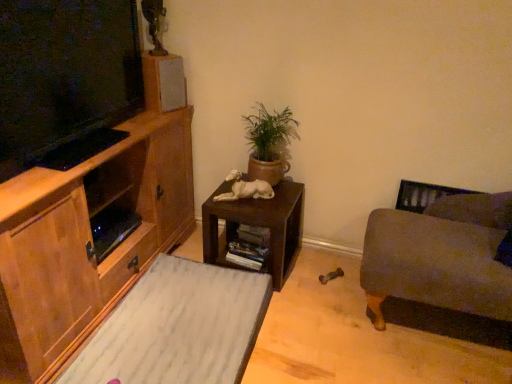
Question: Is velvet gray couch at right positioned before green terracotta pot at center?

Choices:
 (A) no
 (B) yes

Answer: (B)

Question: Does velvet gray couch at right have a greater height compared to green terracotta pot at center?

Choices:
 (A) yes
 (B) no

Answer: (A)

Question: From the image's perspective, does velvet gray couch at right appear lower than green terracotta pot at center?

Choices:
 (A) yes
 (B) no

Answer: (A)

Question: Does velvet gray couch at right come behind green terracotta pot at center?

Choices:
 (A) no
 (B) yes

Answer: (A)

Question: Is velvet gray couch at right completely or partially outside of green terracotta pot at center?

Choices:
 (A) yes
 (B) no

Answer: (A)

Question: Is point (205, 238) positioned closer to the camera than point (239, 279)?

Choices:
 (A) farther
 (B) closer

Answer: (A)

Question: Is dark brown wooden table at center inside or outside of white marble rug at lower left?

Choices:
 (A) outside
 (B) inside

Answer: (A)

Question: From the image's perspective, relative to white marble rug at lower left, is dark brown wooden table at center above or below?

Choices:
 (A) above
 (B) below

Answer: (A)

Question: From a real-world perspective, relative to white marble rug at lower left, is dark brown wooden table at center vertically above or below?

Choices:
 (A) below
 (B) above

Answer: (B)

Question: Considering the positions of matte gray speaker at upper center and wooden cabinet at left in the image, is matte gray speaker at upper center taller or shorter than wooden cabinet at left?

Choices:
 (A) short
 (B) tall

Answer: (A)

Question: From a real-world perspective, relative to wooden cabinet at left, is matte gray speaker at upper center vertically above or below?

Choices:
 (A) above
 (B) below

Answer: (A)

Question: Looking at their shapes, would you say matte gray speaker at upper center is wider or thinner than wooden cabinet at left?

Choices:
 (A) wide
 (B) thin

Answer: (B)

Question: Considering their positions, is matte gray speaker at upper center located in front of or behind wooden cabinet at left?

Choices:
 (A) front
 (B) behind

Answer: (B)

Question: Is white glossy statue at center in front of or behind wooden cabinet at left in the image?

Choices:
 (A) front
 (B) behind

Answer: (B)

Question: From a real-world perspective, is white glossy statue at center positioned above or below wooden cabinet at left?

Choices:
 (A) above
 (B) below

Answer: (A)